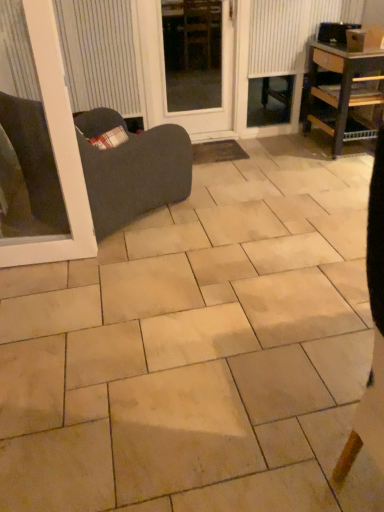
This screenshot has height=512, width=384. I want to click on free space in front of wooden shelf at right, so click(330, 172).